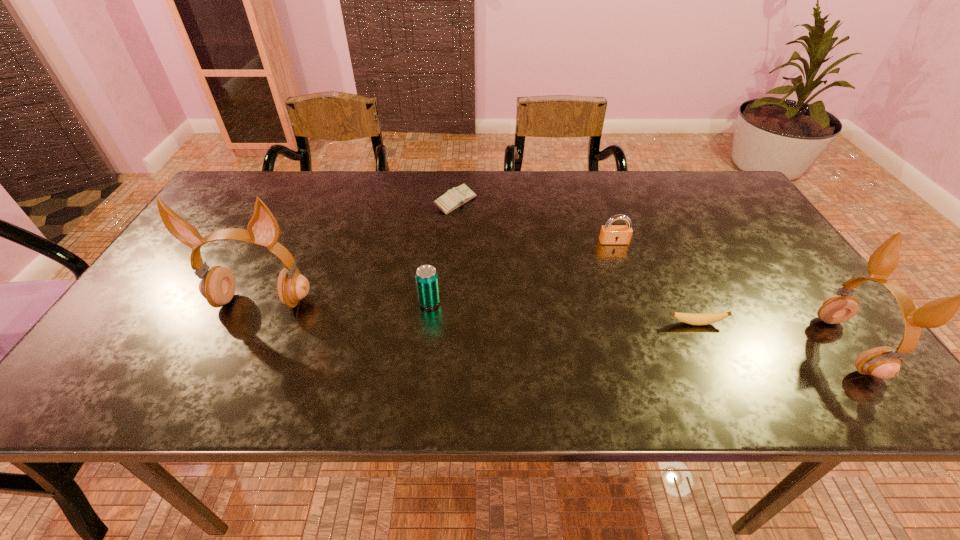
Where is `the left earphone`? This screenshot has width=960, height=540. the left earphone is located at coordinates (217, 286).

Locate an element on the screen. This screenshot has height=540, width=960. the leftmost object is located at coordinates (217, 286).

At what (x,y) coordinates should I click in order to perform the action: click on the shorter earphone. Please return your answer as a coordinate pair (x, y). This screenshot has width=960, height=540. Looking at the image, I should click on (884, 362).

I want to click on the second tallest object, so click(x=884, y=362).

In order to click on diary in this screenshot , I will do `click(453, 198)`.

Where is `beer can`? Image resolution: width=960 pixels, height=540 pixels. beer can is located at coordinates (427, 283).

I want to click on padlock, so click(x=610, y=234).

Find the location of a particular element. the fifth nearest object is located at coordinates (610, 234).

Where is `the fifth object from left to right`? the fifth object from left to right is located at coordinates (691, 318).

You are a GUI agent. You are given a task and a screenshot of the screen. Output one action in this format:
    pyautogui.click(x=<x>, y=<y>)
    Task: Click on the free location located 0.110m on the front-facing side of the left earphone
    
    Given the screenshot: What is the action you would take?
    pyautogui.click(x=235, y=356)